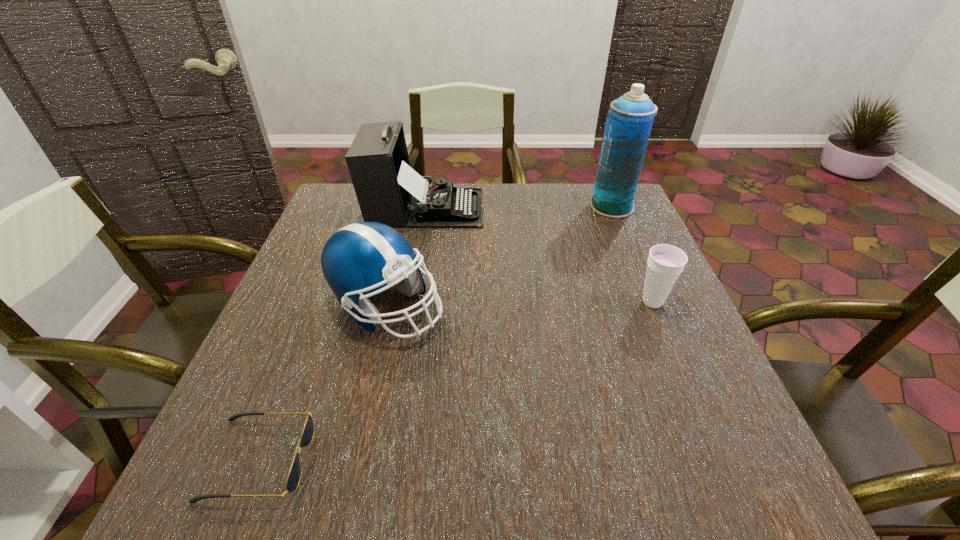
Identify the location of free space in the image that satisfies the following two spatial constraints: 1. on the front side of the cup; 2. at the front of the football helmet with the faceguard. This screenshot has height=540, width=960. (655, 307).

The image size is (960, 540). Find the location of `vacant position in the image that satisfies the following two spatial constraints: 1. on the front side of the tallest object; 2. on the front-facing side of the sunglasses`. vacant position in the image that satisfies the following two spatial constraints: 1. on the front side of the tallest object; 2. on the front-facing side of the sunglasses is located at coordinates (718, 460).

Where is `free spot that satisfies the following two spatial constraints: 1. inside the open case of the fourth shortest object; 2. on the back side of the second shortest object`? The image size is (960, 540). free spot that satisfies the following two spatial constraints: 1. inside the open case of the fourth shortest object; 2. on the back side of the second shortest object is located at coordinates (409, 302).